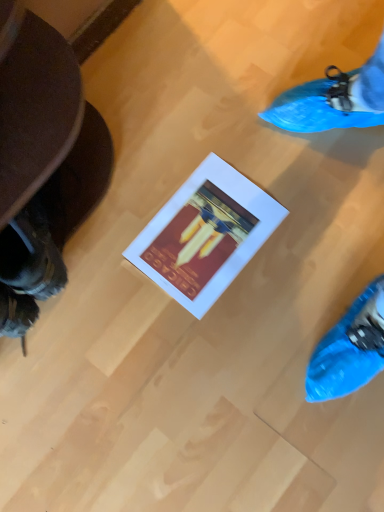
This screenshot has width=384, height=512. What do you see at coordinates (205, 234) in the screenshot? I see `white matte picture frame at center` at bounding box center [205, 234].

At what (x,y) coordinates should I click in order to perform the action: click on white matte picture frame at center. Please return your answer as a coordinate pair (x, y). The height and width of the screenshot is (512, 384). Looking at the image, I should click on (205, 234).

Find the location of a particular element. white matte picture frame at center is located at coordinates (205, 234).